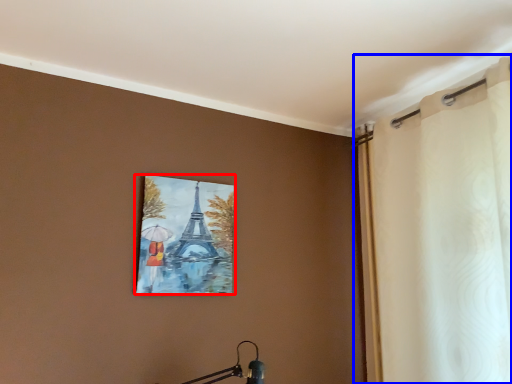
Question: Among these objects, which one is nearest to the camera, picture frame (highlighted by a red box) or curtain (highlighted by a blue box)?

Choices:
 (A) picture frame
 (B) curtain

Answer: (B)